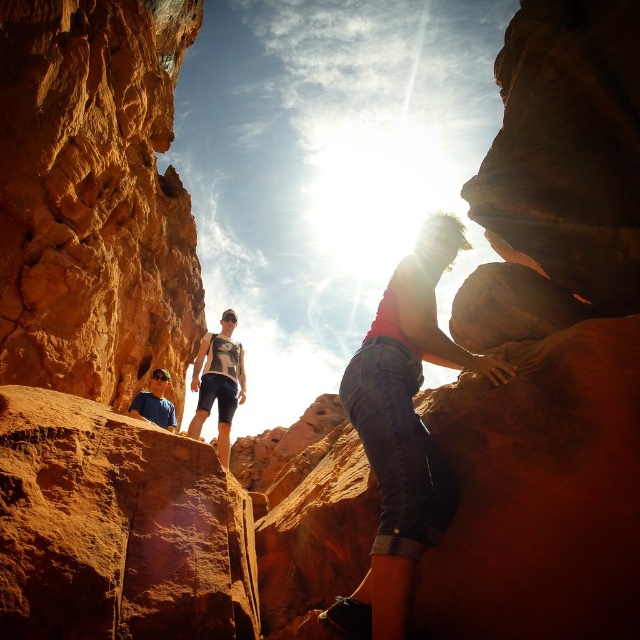
You are a hiker planning to cross from the rustic sandstone rock at left to the matte blue shirt at lower left. Given that your backpack can only hold enough supplies for a 25 meter journey, will you have enough supplies to make the trip?

The rustic sandstone rock at left and matte blue shirt at lower left are 24.79 meters apart. Since your backpack can hold supplies for 25 meters, you have just enough supplies to make the trip.

You are a hiker planning to climb the canyon wall. You see the rustic sandstone rock at left and the denim shorts at center. Which object is higher up the wall?

The rustic sandstone rock at left is located above the denim shorts at center, so it is higher up the wall.